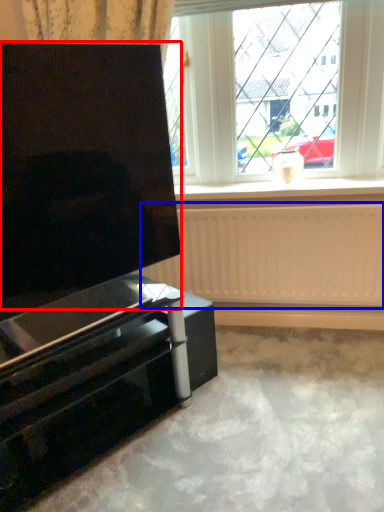
Question: Which point is further to the camera, screen (highlighted by a red box) or radiator (highlighted by a blue box)?

Choices:
 (A) screen
 (B) radiator

Answer: (B)